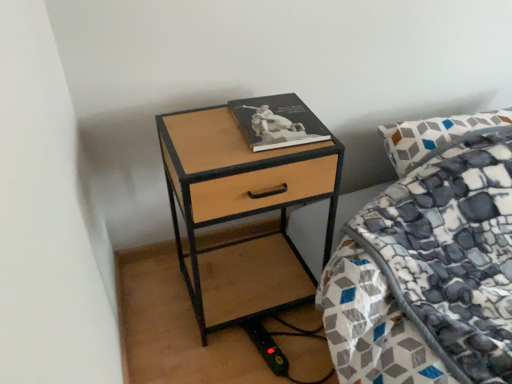
Question: Is hardcover book at upper right shorter than woodenmaterial/texturenightstand at center?

Choices:
 (A) no
 (B) yes

Answer: (B)

Question: From a real-world perspective, is hardcover book at upper right beneath woodenmaterial/texturenightstand at center?

Choices:
 (A) no
 (B) yes

Answer: (A)

Question: Considering the relative sizes of hardcover book at upper right and woodenmaterial/texturenightstand at center in the image provided, is hardcover book at upper right taller than woodenmaterial/texturenightstand at center?

Choices:
 (A) no
 (B) yes

Answer: (A)

Question: Is there a large distance between hardcover book at upper right and woodenmaterial/texturenightstand at center?

Choices:
 (A) yes
 (B) no

Answer: (B)

Question: Is hardcover book at upper right positioned beyond the bounds of woodenmaterial/texturenightstand at center?

Choices:
 (A) no
 (B) yes

Answer: (B)

Question: Does hardcover book at upper right turn towards woodenmaterial/texturenightstand at center?

Choices:
 (A) yes
 (B) no

Answer: (B)

Question: Is woodenmaterial/texturenightstand at center positioned in front of hardcover book at upper right?

Choices:
 (A) yes
 (B) no

Answer: (A)

Question: Is woodenmaterial/texturenightstand at center wider than hardcover book at upper right?

Choices:
 (A) no
 (B) yes

Answer: (B)

Question: Is hardcover book at upper right located within woodenmaterial/texturenightstand at center?

Choices:
 (A) no
 (B) yes

Answer: (A)

Question: Can you confirm if woodenmaterial/texturenightstand at center is thinner than hardcover book at upper right?

Choices:
 (A) no
 (B) yes

Answer: (A)

Question: Is woodenmaterial/texturenightstand at center aimed at hardcover book at upper right?

Choices:
 (A) yes
 (B) no

Answer: (B)

Question: Does woodenmaterial/texturenightstand at center have a greater height compared to hardcover book at upper right?

Choices:
 (A) no
 (B) yes

Answer: (B)

Question: In terms of height, does hardcover book at upper right look taller or shorter compared to woodenmaterial/texturenightstand at center?

Choices:
 (A) tall
 (B) short

Answer: (B)